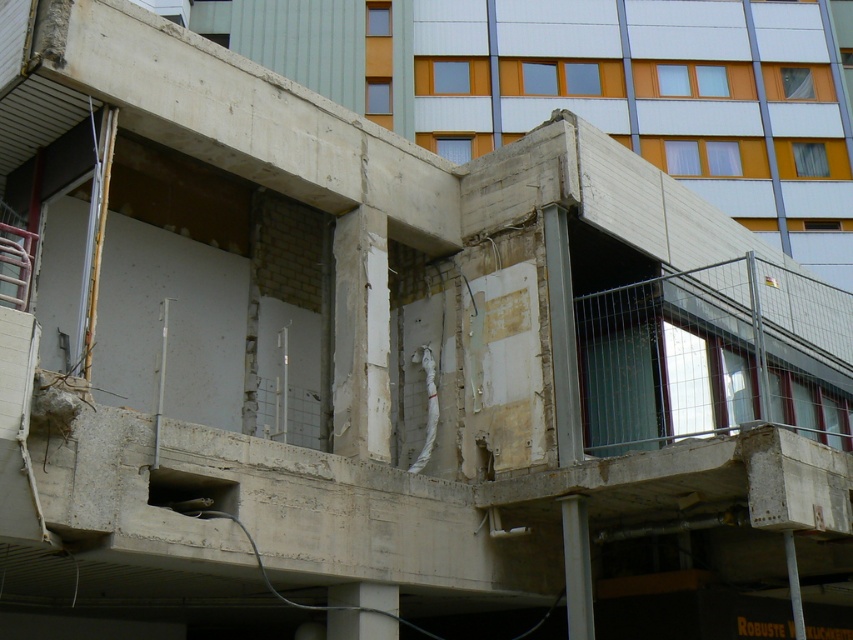
You are an architect inspecting the construction site. You notice the white concrete pillar at lower right and the concrete at lower center. Which one has a smaller width?

The white concrete pillar at lower right has a smaller width than the concrete at lower center.

You are a construction worker standing at the entrance of the building. You need to move a heavy tool from the concrete at lower center to the white concrete pillar at lower right. Which direction should you move the tool?

The white concrete pillar at lower right is to the right of concrete at lower center, so you should move the tool to the right.

You are an inspector checking the construction site. You see the concrete at lower center and the concrete pillar at lower right. Which one has a lower height?

The concrete at lower center is shorter than the concrete pillar at lower right, so the concrete at lower center has a lower height.